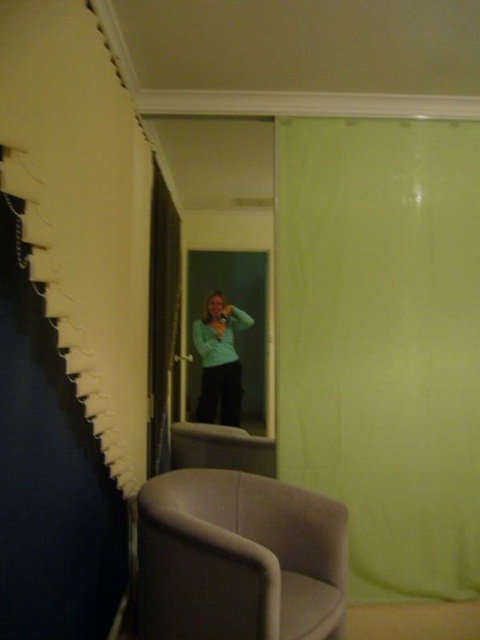
Can you confirm if black velvet curtain at center is thinner than green matte shirt at center?

Yes, black velvet curtain at center is thinner than green matte shirt at center.

Can you confirm if black velvet curtain at center is positioned to the left of green matte shirt at center?

Correct, you'll find black velvet curtain at center to the left of green matte shirt at center.

This screenshot has width=480, height=640. Find the location of `black velvet curtain at center`. black velvet curtain at center is located at coordinates (162, 317).

Between point (153, 385) and point (230, 323), which one is positioned in front?

Point (153, 385) is in front.

Who is positioned more to the left, black velvet curtain at center or green matte sweater at center?

Positioned to the left is black velvet curtain at center.

Which is in front, point (148, 372) or point (231, 314)?

Point (148, 372) is in front.

You are a GUI agent. You are given a task and a screenshot of the screen. Output one action in this format:
    pyautogui.click(x=<x>, y=<y>)
    Task: Click on the black velvet curtain at center
    This screenshot has height=640, width=480.
    Given the screenshot: What is the action you would take?
    pyautogui.click(x=162, y=317)

Is green fabric curtain at center further to camera compared to black velvet curtain at center?

No, green fabric curtain at center is closer to the viewer.

I want to click on green fabric curtain at center, so click(383, 342).